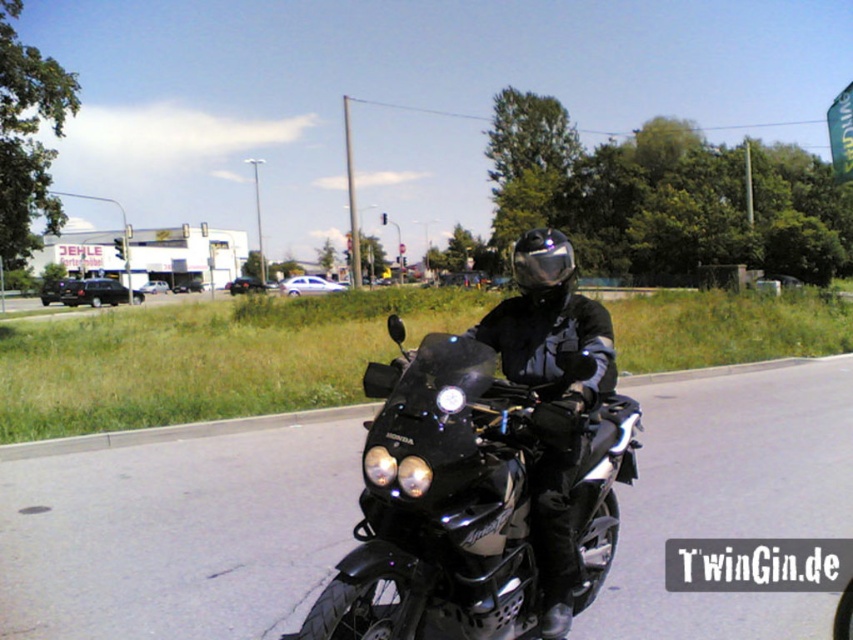
You are a photographer positioned on the side of the road. You want to take a photo of the black matte motorcycle at center and the shiny black helmet at center. Which object should you focus on first to ensure both are in sharp focus?

The black matte motorcycle at center is closer to the viewer than the shiny black helmet at center, so focus on the motorcycle first. This way, both objects will be in focus as the helmet is further away but still within the depth of field.

You are a drone operator trying to capture aerial footage of the two points in the scene. The first point is at coordinates point (418, 573) and the second point is at point (563, 294). Which point should you fly the drone to first to ensure it appears larger in the footage?

Point (418, 573) is closer to the viewer than point (563, 294), so flying the drone to point (418, 573) first will make it appear larger in the footage.

You are a delivery person who needs to secure a shiny black helmet at center onto a black matte motorcycle at center. Based on their positions in the image, can you determine if the helmet will fit properly on the motorcycle?

The black matte motorcycle at center is positioned on the left side of shiny black helmet at center, which means the helmet is on the right side of the motorcycle. Since the helmet is meant to be placed on the motorcycle, its current position to the right might indicate it needs to be moved to the correct mounting spot on the motorcycle.